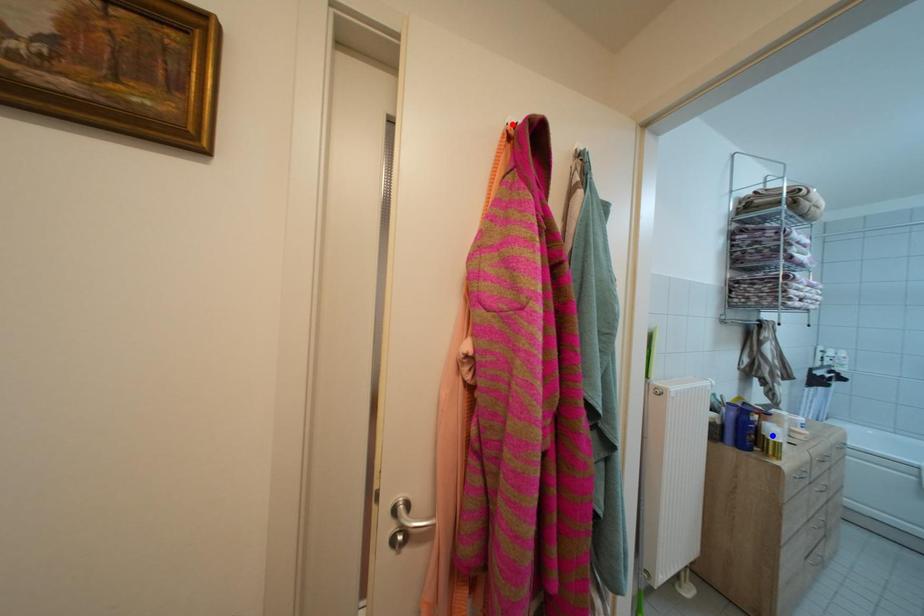
Question: Two points are marked on the image. Which point is closer to the camera?

Choices:
 (A) Blue point is closer.
 (B) Red point is closer.

Answer: (B)